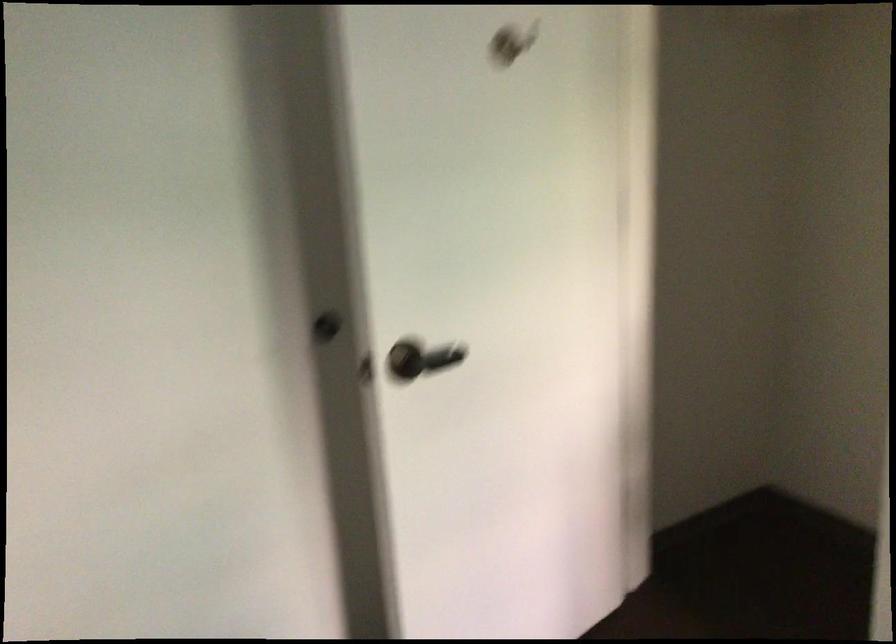
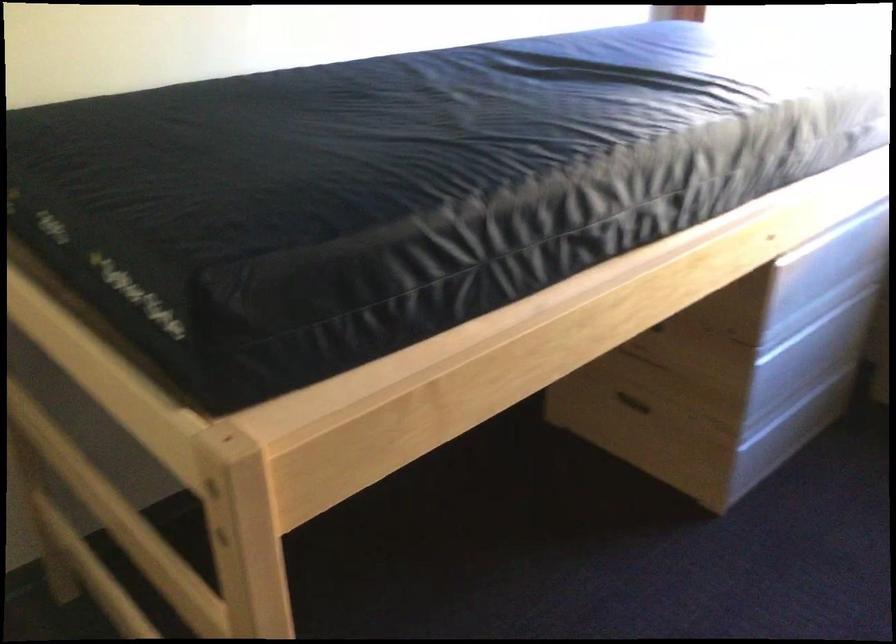
The first image is from the beginning of the video and the second image is from the end. How did the camera likely rotate when shooting the video?

The camera's rotation is toward right-down.